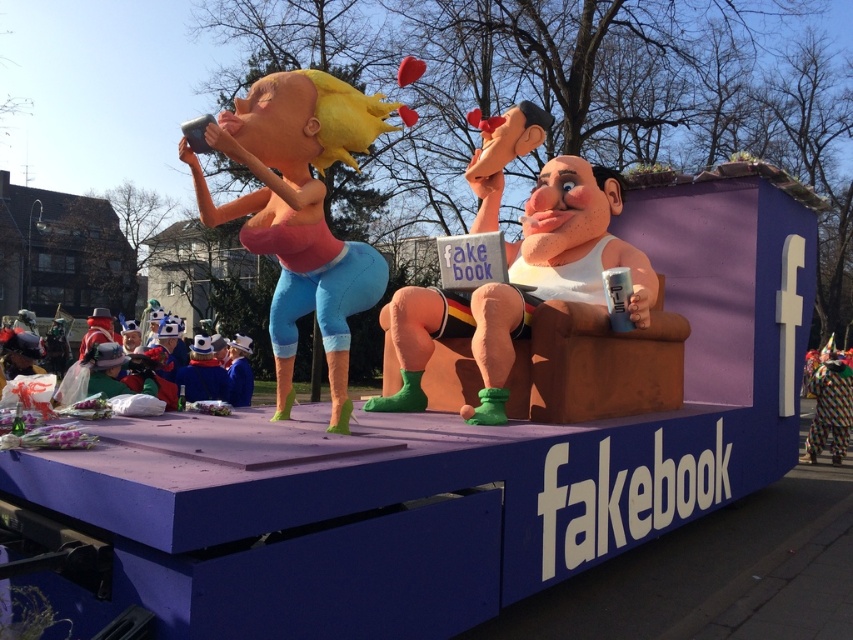
Is matte orange figure at left further to the viewer compared to smooth plastic figure at center?

No.

Who is more distant from viewer, (270,308) or (492,186)?

Positioned behind is point (492,186).

Locate an element on the screen. This screenshot has width=853, height=640. matte orange figure at left is located at coordinates (299, 211).

Which is above, smooth plastic figure at center or multicolored fabric clown at lower right?

smooth plastic figure at center

Can you confirm if smooth plastic figure at center is positioned below multicolored fabric clown at lower right?

Incorrect, smooth plastic figure at center is not positioned below multicolored fabric clown at lower right.

Locate an element on the screen. The image size is (853, 640). smooth plastic figure at center is located at coordinates (520, 288).

This screenshot has height=640, width=853. I want to click on smooth plastic figure at center, so click(520, 288).

Does matte orange figure at left have a lesser width compared to multicolored fabric clown at lower right?

Yes.

Does matte orange figure at left appear on the right side of multicolored fabric clown at lower right?

No, matte orange figure at left is not to the right of multicolored fabric clown at lower right.

Locate an element on the screen. Image resolution: width=853 pixels, height=640 pixels. matte orange figure at left is located at coordinates (299, 211).

Find the location of a particular element. This screenshot has width=853, height=640. matte orange figure at left is located at coordinates (299, 211).